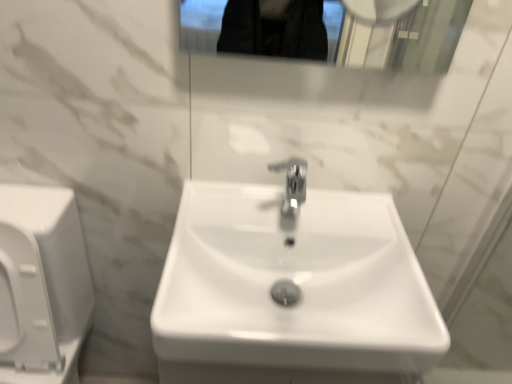
Question: Could you tell me if white glossy sink at center is facing white glossy toilet at left?

Choices:
 (A) yes
 (B) no

Answer: (B)

Question: Considering the relative positions of white glossy sink at center and white glossy toilet at left in the image provided, is white glossy sink at center in front of white glossy toilet at left?

Choices:
 (A) no
 (B) yes

Answer: (A)

Question: From the image's perspective, is white glossy sink at center over white glossy toilet at left?

Choices:
 (A) yes
 (B) no

Answer: (A)

Question: Is white glossy sink at center looking in the opposite direction of white glossy toilet at left?

Choices:
 (A) yes
 (B) no

Answer: (B)

Question: Can you confirm if white glossy sink at center is shorter than white glossy toilet at left?

Choices:
 (A) no
 (B) yes

Answer: (B)

Question: Can you confirm if white glossy sink at center is positioned to the left of white glossy toilet at left?

Choices:
 (A) yes
 (B) no

Answer: (B)

Question: From the image's perspective, does white glossy toilet at left appear lower than white glossy sink at center?

Choices:
 (A) no
 (B) yes

Answer: (B)

Question: From the image's perspective, is white glossy toilet at left over white glossy sink at center?

Choices:
 (A) yes
 (B) no

Answer: (B)

Question: Does white glossy toilet at left come behind white glossy sink at center?

Choices:
 (A) yes
 (B) no

Answer: (B)

Question: Does white glossy toilet at left appear on the right side of white glossy sink at center?

Choices:
 (A) yes
 (B) no

Answer: (B)

Question: Is white glossy toilet at left to the left of white glossy sink at center from the viewer's perspective?

Choices:
 (A) no
 (B) yes

Answer: (B)

Question: Is white glossy toilet at left wider than white glossy sink at center?

Choices:
 (A) yes
 (B) no

Answer: (A)

Question: Based on their positions, is white glossy sink at center located to the left or right of white glossy toilet at left?

Choices:
 (A) right
 (B) left

Answer: (A)